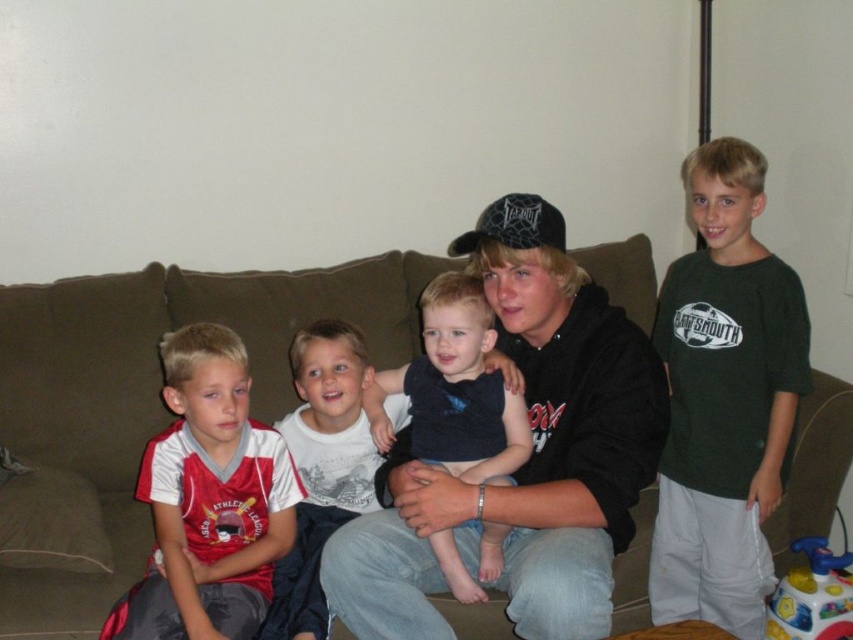
Question: Is brown fabric couch at center above white cotton shirt at center?

Choices:
 (A) no
 (B) yes

Answer: (B)

Question: Does dark blue sleeveless shirt at center appear on the left side of white cotton shirt at center?

Choices:
 (A) yes
 (B) no

Answer: (B)

Question: From the image, what is the correct spatial relationship of black matte hoodie at center in relation to white cotton shirt at center?

Choices:
 (A) right
 (B) left

Answer: (A)

Question: Which object is farther from the camera taking this photo?

Choices:
 (A) red and white athletic jersey at left
 (B) white cotton shirt at center

Answer: (B)

Question: Estimate the real-world distances between objects in this image. Which object is closer to the black matte hoodie at center?

Choices:
 (A) red and white athletic jersey at left
 (B) plastic colorful ball at lower right
 (C) dark green t-shirt at right

Answer: (A)

Question: Which of the following is the farthest from the observer?

Choices:
 (A) white cotton shirt at center
 (B) red and white athletic jersey at left
 (C) plastic colorful ball at lower right

Answer: (C)